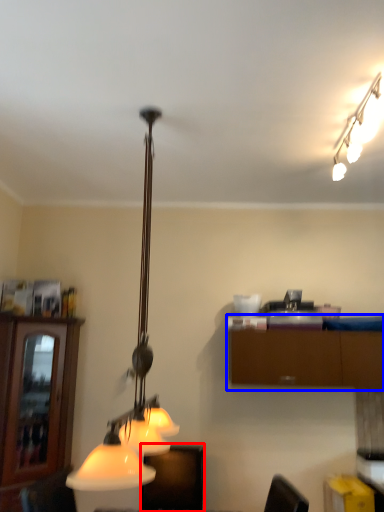
Question: Which point is closer to the camera, furniture (highlighted by a red box) or cabinetry (highlighted by a blue box)?

Choices:
 (A) furniture
 (B) cabinetry

Answer: (A)